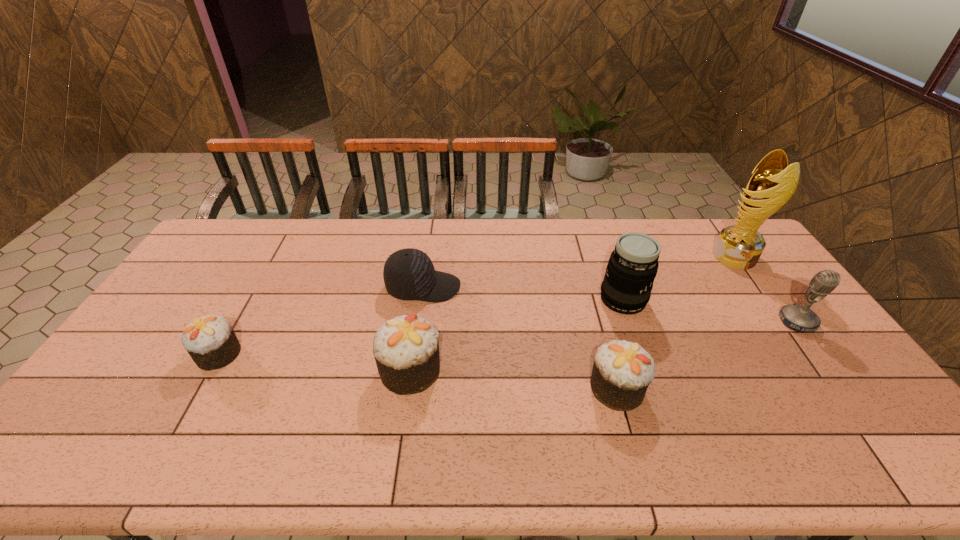
This screenshot has height=540, width=960. What are the coordinates of `microphone present at the right edge` in the screenshot? It's located at (799, 318).

Locate an element on the screen. This screenshot has height=540, width=960. object located in the far right corner section of the desktop is located at coordinates (739, 246).

Locate an element on the screen. The width and height of the screenshot is (960, 540). free spot at the far edge of the desktop is located at coordinates (457, 231).

Locate an element on the screen. free space at the near edge of the desktop is located at coordinates (272, 423).

Identify the location of vacant space at the left edge of the desktop. (127, 367).

What are the coordinates of `vacant area at the right edge of the desktop` in the screenshot? It's located at pos(843,364).

Locate an element on the screen. The image size is (960, 540). vacant position at the far left corner of the desktop is located at coordinates (214, 241).

In order to click on vacant area between the second tallest cupcake and the microphone in this screenshot , I will do `click(708, 355)`.

This screenshot has width=960, height=540. Find the location of `free point between the tallest object and the second cupcake from right to left`. free point between the tallest object and the second cupcake from right to left is located at coordinates (572, 314).

You are a GUI agent. You are given a task and a screenshot of the screen. Output one action in this format:
    pyautogui.click(x=<x>, y=<y>)
    Task: Click on the empty location between the leftmost object and the microphone
    The image size is (960, 540).
    Given the screenshot: What is the action you would take?
    pos(508,338)